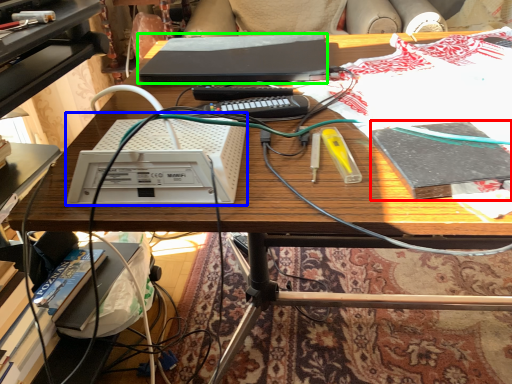
Question: Estimate the real-world distances between objects in this image. Which object is closer to book (highlighted by a red box), equipment (highlighted by a blue box) or computer (highlighted by a green box)?

Choices:
 (A) equipment
 (B) computer

Answer: (A)